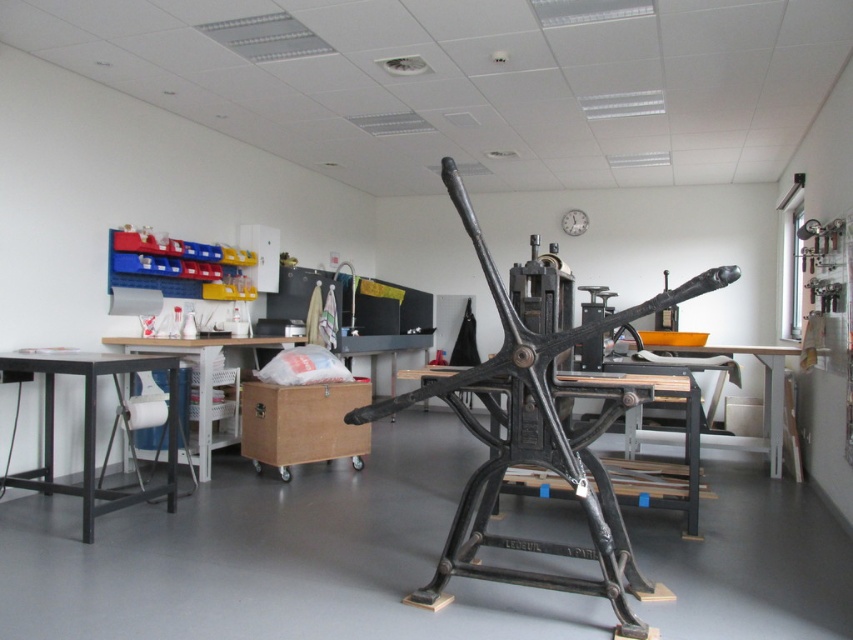
Is the position of black metal table at left more distant than that of wooden table at center?

That is False.

Can you confirm if black metal table at left is wider than wooden table at center?

→ Correct, the width of black metal table at left exceeds that of wooden table at center.

Locate an element on the screen. black metal table at left is located at coordinates click(x=91, y=428).

Does black cast iron press at center appear under black metal table at center?

No, black cast iron press at center is not below black metal table at center.

Between black cast iron press at center and black metal table at center, which one is positioned higher?

Positioned higher is black cast iron press at center.

I want to click on black cast iron press at center, so click(535, 442).

Locate an element on the screen. Image resolution: width=853 pixels, height=640 pixels. black cast iron press at center is located at coordinates coord(535,442).

Between black metal table at left and white plastic table at left, which one appears on the right side from the viewer's perspective?

white plastic table at left

Between point (21, 355) and point (291, 339), which one is positioned behind?

The point (291, 339) is more distant.

What do you see at coordinates (91, 428) in the screenshot?
I see `black metal table at left` at bounding box center [91, 428].

You are a GUI agent. You are given a task and a screenshot of the screen. Output one action in this format:
    pyautogui.click(x=<x>, y=<y>)
    Task: Click on the black metal table at left
    This screenshot has height=640, width=853.
    Given the screenshot: What is the action you would take?
    pyautogui.click(x=91, y=428)